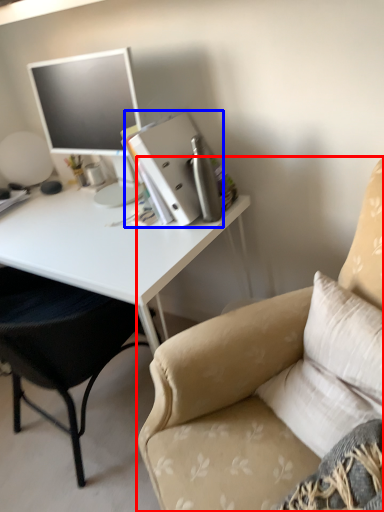
Question: Which point is further to the camera, chair (highlighted by a red box) or binder (highlighted by a blue box)?

Choices:
 (A) chair
 (B) binder

Answer: (B)